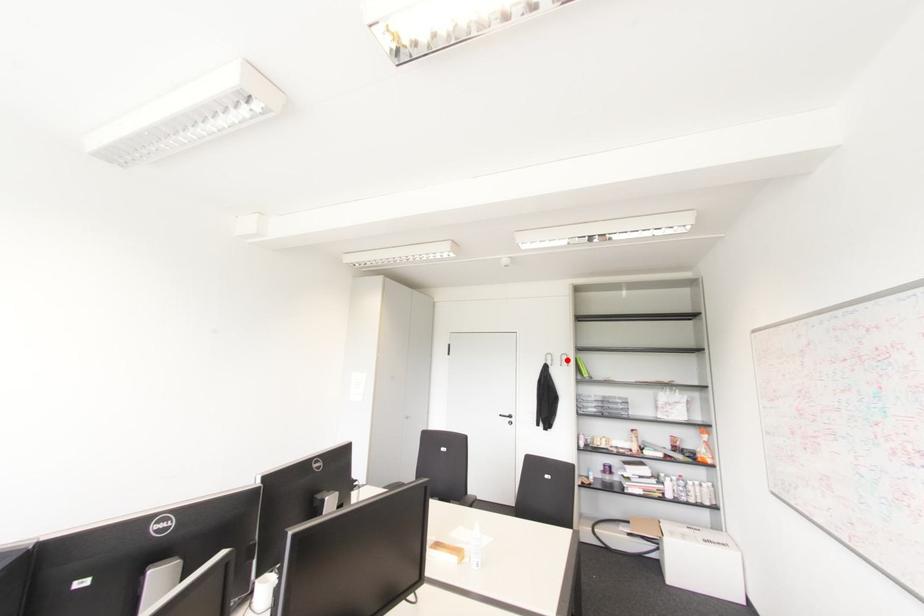
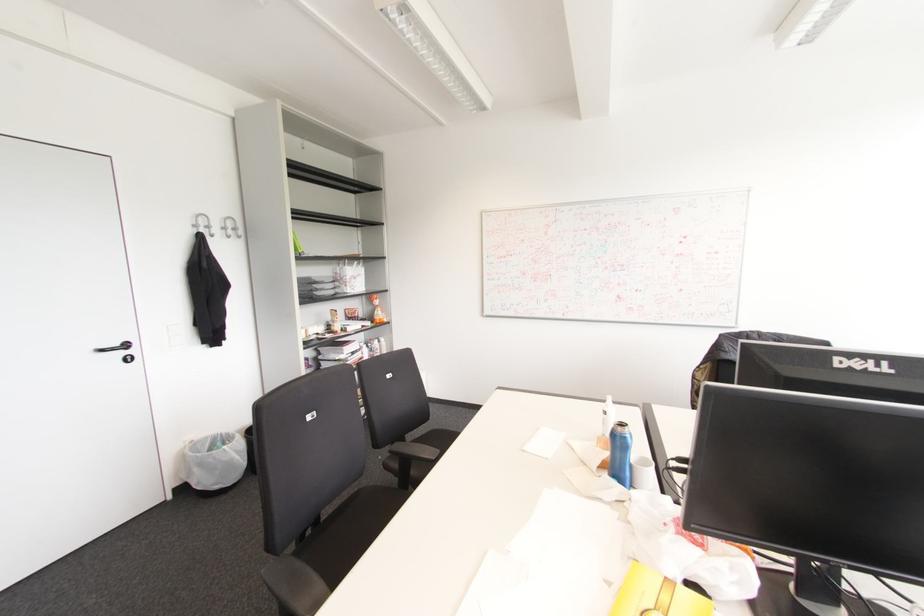
Where in the second image is the point corresponding to the highlighted location from the first image?

(234, 229)